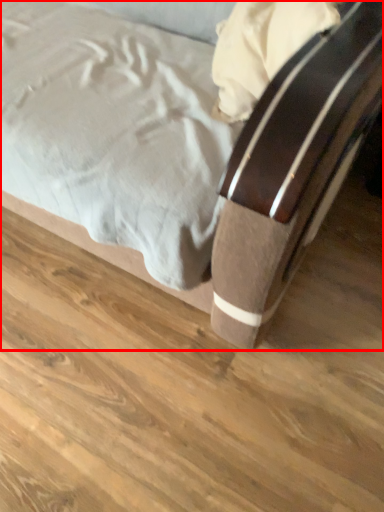
Question: From the image's perspective, what is the correct spatial relationship of bed (annotated by the red box) in relation to plank?

Choices:
 (A) below
 (B) above

Answer: (B)